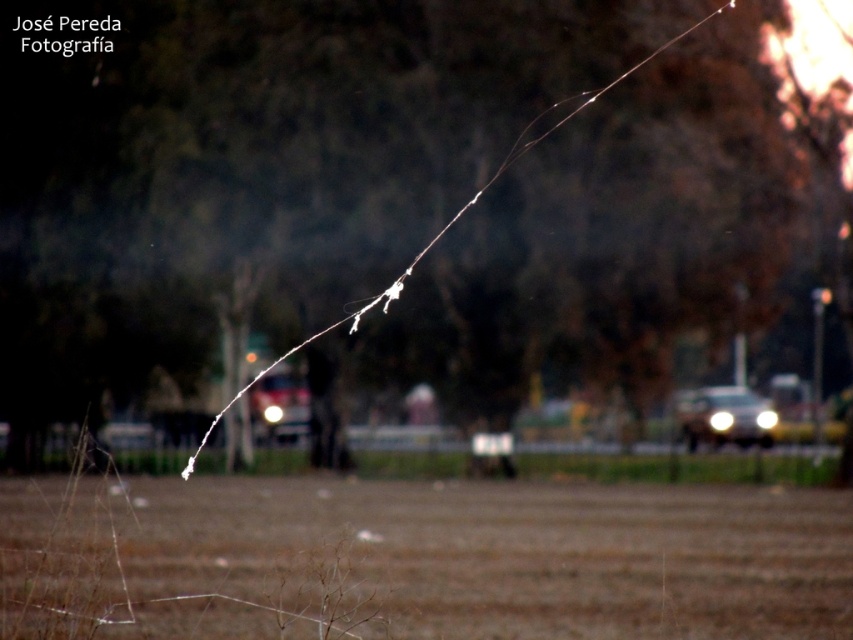
Question: Among these objects, which one is nearest to the camera?

Choices:
 (A) shiny silver car at right
 (B) brown soil at center

Answer: (B)

Question: Is brown soil at center to the right of shiny silver car at right from the viewer's perspective?

Choices:
 (A) no
 (B) yes

Answer: (A)

Question: Is brown soil at center wider than shiny silver car at right?

Choices:
 (A) no
 (B) yes

Answer: (B)

Question: Which point is closer to the camera taking this photo?

Choices:
 (A) (706, 540)
 (B) (747, 433)

Answer: (A)

Question: Can you confirm if brown soil at center is positioned above shiny silver car at right?

Choices:
 (A) no
 (B) yes

Answer: (A)

Question: Which point is closer to the camera taking this photo?

Choices:
 (A) (735, 417)
 (B) (221, 554)

Answer: (B)